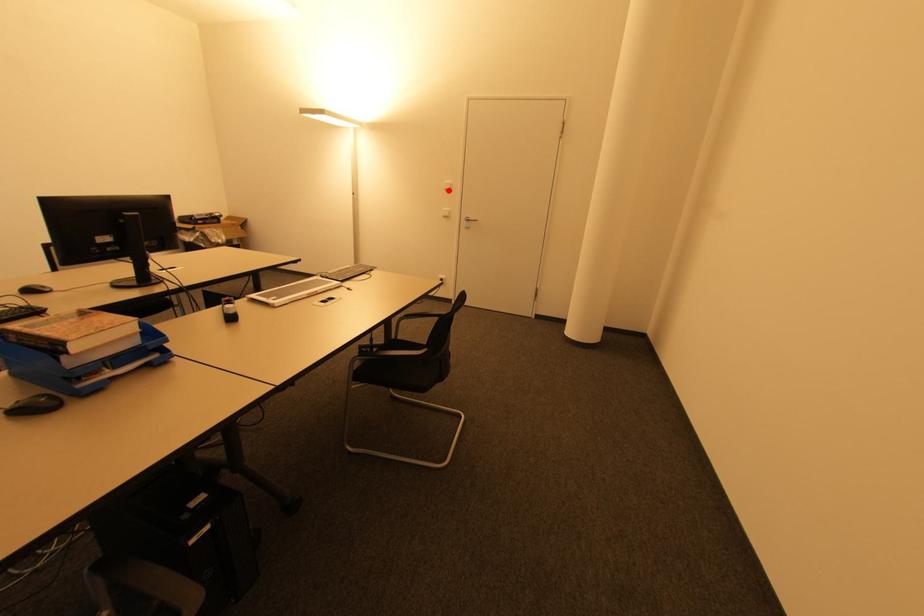
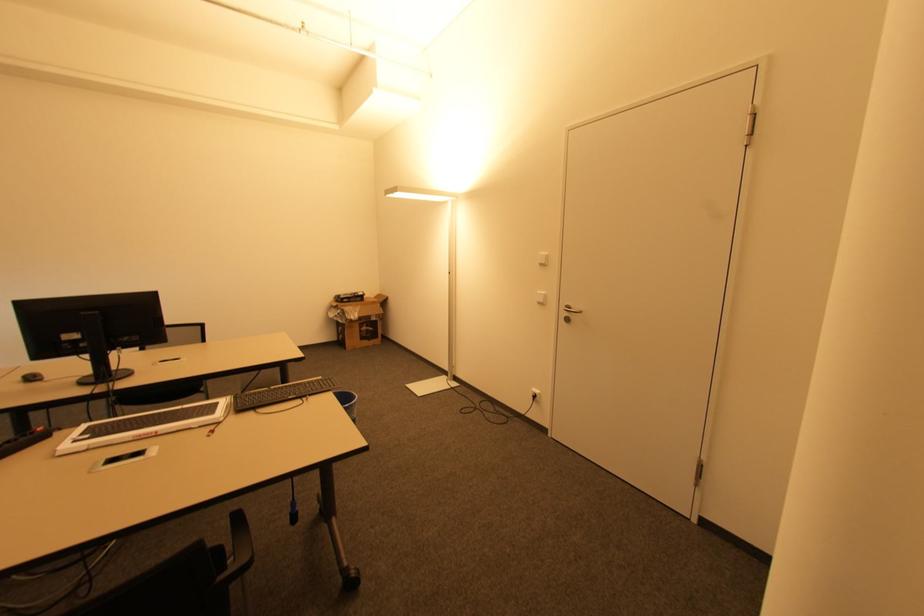
Question: I am providing you with two images of the same scene from different viewpoints. A red point is shown in image1. For the corresponding object point in image2, is it positioned nearer or farther from the camera?

Choices:
 (A) Nearer
 (B) Farther

Answer: (B)